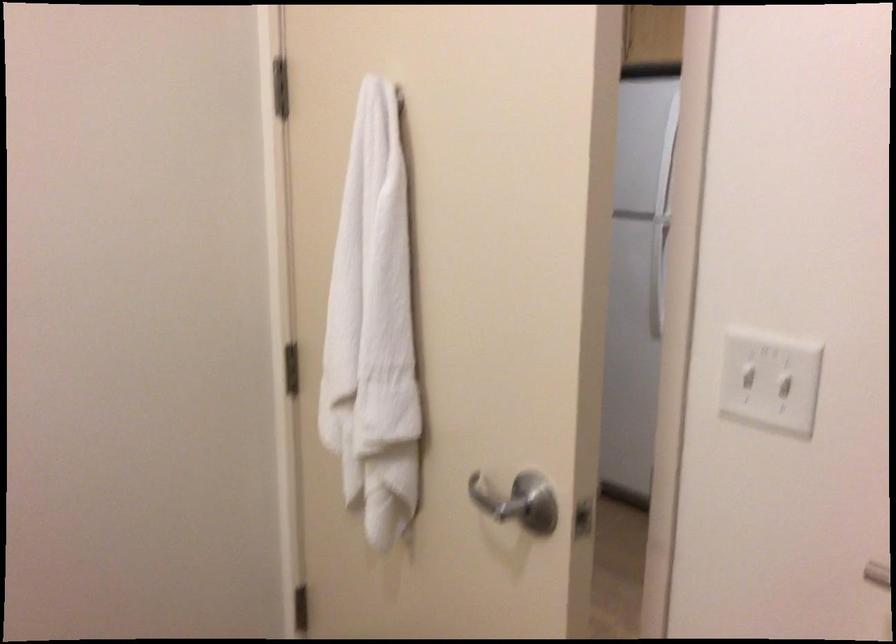
This screenshot has width=896, height=644. Find the location of `silver door handle`. silver door handle is located at coordinates (494, 500).